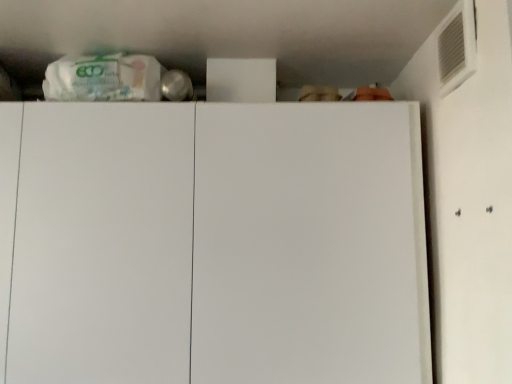
Question: Looking at the image, does white plastic air conditioning at upper right seem bigger or smaller compared to white matte cabinet at center?

Choices:
 (A) big
 (B) small

Answer: (B)

Question: Considering their positions, is white plastic air conditioning at upper right located in front of or behind white matte cabinet at center?

Choices:
 (A) behind
 (B) front

Answer: (B)

Question: Do you think white plastic air conditioning at upper right is within white matte cabinet at center, or outside of it?

Choices:
 (A) outside
 (B) inside

Answer: (A)

Question: Considering the positions of point (373, 271) and point (450, 29), is point (373, 271) closer or farther from the camera than point (450, 29)?

Choices:
 (A) farther
 (B) closer

Answer: (A)

Question: Would you say white matte cabinet at center is inside or outside white plastic air conditioning at upper right?

Choices:
 (A) outside
 (B) inside

Answer: (A)

Question: Is white matte cabinet at center in front of or behind white plastic air conditioning at upper right in the image?

Choices:
 (A) behind
 (B) front

Answer: (A)

Question: From a real-world perspective, relative to white plastic air conditioning at upper right, is white matte cabinet at center vertically above or below?

Choices:
 (A) below
 (B) above

Answer: (A)